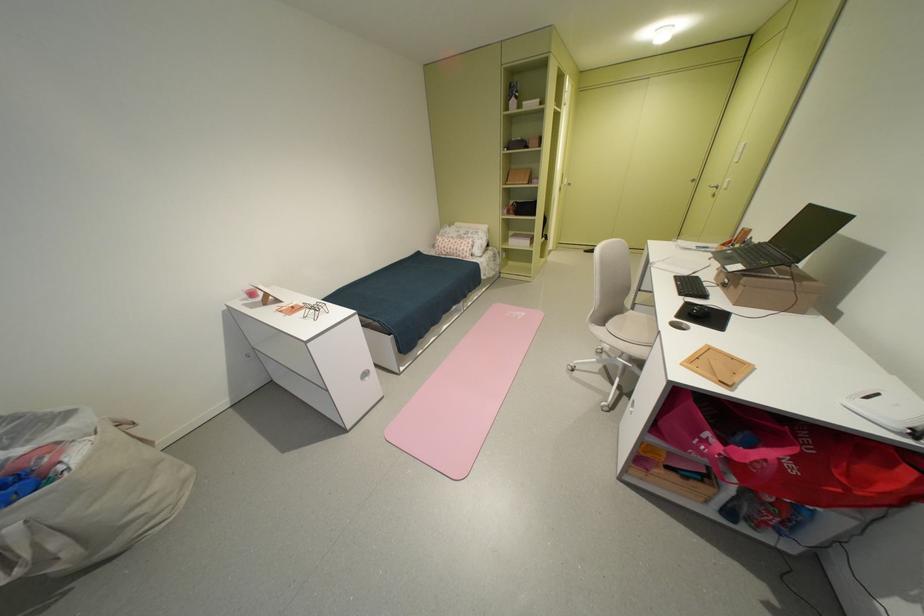
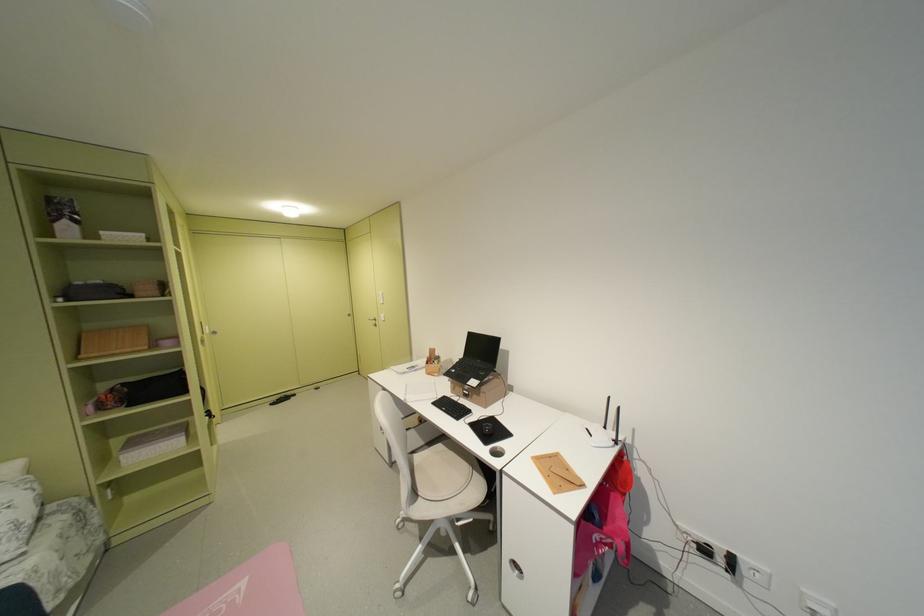
Question: The first image is from the beginning of the video and the second image is from the end. How did the camera likely rotate when shooting the video?

Choices:
 (A) Left
 (B) Right
 (C) Up
 (D) Down

Answer: (B)